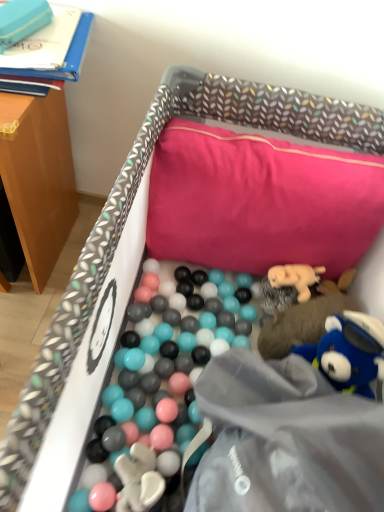
This screenshot has width=384, height=512. Describe the element at coordinates (22, 20) in the screenshot. I see `matte blue box at upper left, which is counted as the 1th toy, starting from the left` at that location.

Where is `soft beige plush bear at center-right, which is counted as the second toy, starting from the left`? soft beige plush bear at center-right, which is counted as the second toy, starting from the left is located at coordinates (295, 278).

Can you tell me how much blue plush toy at lower right, the 4th toy viewed from the top, and pink fabric pillow at upper center differ in facing direction?

They differ by 4.42 degrees in their facing directions.

Between blue plush toy at lower right, arranged as the first toy when viewed from the right, and pink fabric pillow at upper center, which one has more height?

pink fabric pillow at upper center.

Which is behind, blue plush toy at lower right, arranged as the first toy when viewed from the right, or pink fabric pillow at upper center?

pink fabric pillow at upper center.

From a real-world perspective, who is located lower, blue plush toy at lower right, which is the 1th toy from bottom to top, or pink fabric pillow at upper center?

From a 3D spatial view, blue plush toy at lower right, which is the 1th toy from bottom to top, is below.

Does matte blue box at upper left, the 4th toy from the right, appear on the right side of wooden table at upper left?

Indeed, matte blue box at upper left, the 4th toy from the right, is positioned on the right side of wooden table at upper left.

Is matte blue box at upper left, the fourth toy from the bottom, facing away from wooden table at upper left?

That's not correct — matte blue box at upper left, the fourth toy from the bottom, is not looking away from wooden table at upper left.

Locate an element on the screen. The width and height of the screenshot is (384, 512). table that appears on the left of matte blue box at upper left, the fourth toy from the bottom is located at coordinates (38, 176).

Can you confirm if matte blue box at upper left, the fourth toy from the bottom, is bigger than wooden table at upper left?

No.

In the scene shown: Can you tell me how much soft beige plush bear at center-right, arranged as the 3th toy when viewed from the right, and wooden table at upper left differ in facing direction?

85.8 degrees.

Is soft beige plush bear at center-right, the 3th toy ordered from the bottom, to the left of wooden table at upper left from the viewer's perspective?

Incorrect, soft beige plush bear at center-right, the 3th toy ordered from the bottom, is not on the left side of wooden table at upper left.

Between soft beige plush bear at center-right, arranged as the 3th toy when viewed from the right, and wooden table at upper left, which one is positioned in front?

wooden table at upper left is in front.

From the image's perspective, between soft beige plush bear at center-right, which is the 2th toy in top-to-bottom order, and wooden table at upper left, which one is located above?

From the image's view, wooden table at upper left is above.

In the scene shown: Which object is thinner, soft plush bear at upper right, the third toy viewed from the top, or matte blue box at upper left, the 4th toy from the right?

matte blue box at upper left, the 4th toy from the right.

Is soft plush bear at upper right, the third toy viewed from the top, with matte blue box at upper left, the 4th toy from the right?

No, soft plush bear at upper right, the third toy viewed from the top, is not in contact with matte blue box at upper left, the 4th toy from the right.

Can you confirm if soft plush bear at upper right, the 2th toy from the bottom, is positioned to the right of matte blue box at upper left, which ranks as the first toy in top-to-bottom order?

Indeed, soft plush bear at upper right, the 2th toy from the bottom, is positioned on the right side of matte blue box at upper left, which ranks as the first toy in top-to-bottom order.

How many degrees apart are the facing directions of soft plush bear at upper right, arranged as the 2th toy when viewed from the right, and matte blue box at upper left, the fourth toy from the bottom?

The facing directions of soft plush bear at upper right, arranged as the 2th toy when viewed from the right, and matte blue box at upper left, the fourth toy from the bottom, are 71.9 degrees apart.

You are a GUI agent. You are given a task and a screenshot of the screen. Output one action in this format:
    pyautogui.click(x=<x>, y=<y>)
    Task: Click on the toy that is the 1st object above the wooden table at upper left (from a real-world perspective)
    The height and width of the screenshot is (512, 384).
    Given the screenshot: What is the action you would take?
    pyautogui.click(x=349, y=353)

Between wooden table at upper left and blue plush toy at lower right, the fourth toy viewed from the left, which one appears on the left side from the viewer's perspective?

wooden table at upper left.

From the image's perspective, does wooden table at upper left appear lower than blue plush toy at lower right, arranged as the first toy when viewed from the right?

No, from the image's perspective, wooden table at upper left is not beneath blue plush toy at lower right, arranged as the first toy when viewed from the right.

Is wooden table at upper left oriented towards blue plush toy at lower right, the 4th toy viewed from the top?

No.

Can you see matte blue box at upper left, the fourth toy from the bottom, touching soft beige plush bear at center-right, which is the 2th toy in top-to-bottom order?

matte blue box at upper left, the fourth toy from the bottom, is not next to soft beige plush bear at center-right, which is the 2th toy in top-to-bottom order, and they're not touching.

From the image's perspective, is matte blue box at upper left, the fourth toy from the bottom, under soft beige plush bear at center-right, which is counted as the second toy, starting from the left?

No, from the image's perspective, matte blue box at upper left, the fourth toy from the bottom, is not beneath soft beige plush bear at center-right, which is counted as the second toy, starting from the left.

Is matte blue box at upper left, the fourth toy from the bottom, thinner than soft beige plush bear at center-right, arranged as the 3th toy when viewed from the right?

No.

Is matte blue box at upper left, the fourth toy from the bottom, taller or shorter than soft beige plush bear at center-right, which is the 2th toy in top-to-bottom order?

matte blue box at upper left, the fourth toy from the bottom, is shorter than soft beige plush bear at center-right, which is the 2th toy in top-to-bottom order.

From their relative heights in the image, would you say blue plush toy at lower right, the fourth toy viewed from the left, is taller or shorter than wooden table at upper left?

Considering their sizes, blue plush toy at lower right, the fourth toy viewed from the left, has less height than wooden table at upper left.

Which toy is the 4th one when counting from the right side of the wooden table at upper left? Please provide its 2D coordinates.

[(349, 353)]

What are the coordinates of `the 2nd toy in front of the pink fabric pillow at upper center, starting your count from the anchor` in the screenshot? It's located at (349, 353).

Image resolution: width=384 pixels, height=512 pixels. What are the coordinates of `the 2nd toy behind the wooden table at upper left, starting your count from the anchor` in the screenshot? It's located at (22, 20).

From the image, which object appears to be farther from matte blue box at upper left, the fourth toy from the bottom, pink fabric pillow at upper center or blue plush toy at lower right, arranged as the first toy when viewed from the right?

blue plush toy at lower right, arranged as the first toy when viewed from the right, is further to matte blue box at upper left, the fourth toy from the bottom.

Based on their spatial positions, is matte blue box at upper left, which is counted as the 1th toy, starting from the left, or pink fabric pillow at upper center closer to soft plush bear at upper right, arranged as the third toy when viewed from the left?

pink fabric pillow at upper center is positioned closer to the anchor soft plush bear at upper right, arranged as the third toy when viewed from the left.

Looking at the image, which one is located closer to soft plush bear at upper right, the 2th toy from the bottom, matte blue box at upper left, which is counted as the 1th toy, starting from the left, or soft beige plush bear at center-right, arranged as the 3th toy when viewed from the right?

soft beige plush bear at center-right, arranged as the 3th toy when viewed from the right, is closer to soft plush bear at upper right, the 2th toy from the bottom.

Estimate the real-world distances between objects in this image. Which object is closer to pink fabric pillow at upper center, matte blue box at upper left, the 4th toy from the right, or wooden table at upper left?

wooden table at upper left is positioned closer to the anchor pink fabric pillow at upper center.

Based on their spatial positions, is wooden table at upper left or matte blue box at upper left, the fourth toy from the bottom, further from blue plush toy at lower right, the 4th toy viewed from the top?

The object further to blue plush toy at lower right, the 4th toy viewed from the top, is matte blue box at upper left, the fourth toy from the bottom.

Based on their spatial positions, is soft beige plush bear at center-right, the 3th toy ordered from the bottom, or blue plush toy at lower right, arranged as the first toy when viewed from the right, further from pink fabric pillow at upper center?

blue plush toy at lower right, arranged as the first toy when viewed from the right.

When comparing their distances from pink fabric pillow at upper center, does wooden table at upper left or matte blue box at upper left, which ranks as the first toy in top-to-bottom order, seem closer?

Among the two, wooden table at upper left is located nearer to pink fabric pillow at upper center.

When comparing their distances from wooden table at upper left, does matte blue box at upper left, the fourth toy from the bottom, or soft plush bear at upper right, arranged as the third toy when viewed from the left, seem closer?

matte blue box at upper left, the fourth toy from the bottom, lies closer to wooden table at upper left than the other object.

Find the location of `pillow between wooden table at upper left and soft beige plush bear at center-right, which is counted as the second toy, starting from the left, in the horizontal direction`. pillow between wooden table at upper left and soft beige plush bear at center-right, which is counted as the second toy, starting from the left, in the horizontal direction is located at coordinates (260, 201).

The height and width of the screenshot is (512, 384). Find the location of `toy situated between wooden table at upper left and soft beige plush bear at center-right, which is the 2th toy in top-to-bottom order, from left to right`. toy situated between wooden table at upper left and soft beige plush bear at center-right, which is the 2th toy in top-to-bottom order, from left to right is located at coordinates (22, 20).

Find the location of a particular element. The image size is (384, 512). toy situated between matte blue box at upper left, which ranks as the first toy in top-to-bottom order, and soft plush bear at upper right, arranged as the 2th toy when viewed from the right, from left to right is located at coordinates (295, 278).

Where is `pillow between wooden table at upper left and soft plush bear at upper right, arranged as the 2th toy when viewed from the right`? The height and width of the screenshot is (512, 384). pillow between wooden table at upper left and soft plush bear at upper right, arranged as the 2th toy when viewed from the right is located at coordinates click(x=260, y=201).